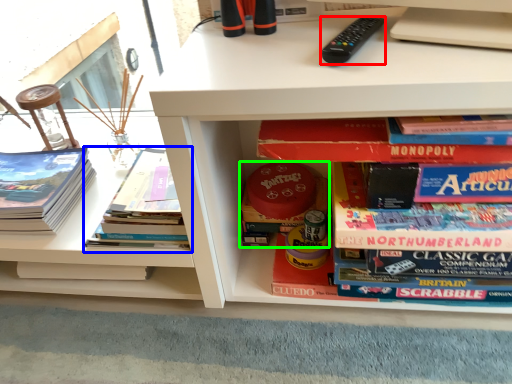
Question: Which object is positioned closest to remote control (highlighted by a red box)? Select from book (highlighted by a blue box) and book (highlighted by a green box).

Choices:
 (A) book
 (B) book

Answer: (B)